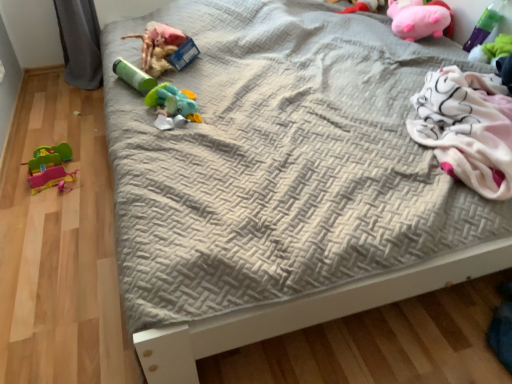
Identify the location of vacant region to the right of rubber duck at left, which is the seventh toy in right-to-left order. The image size is (512, 384). 93,178.